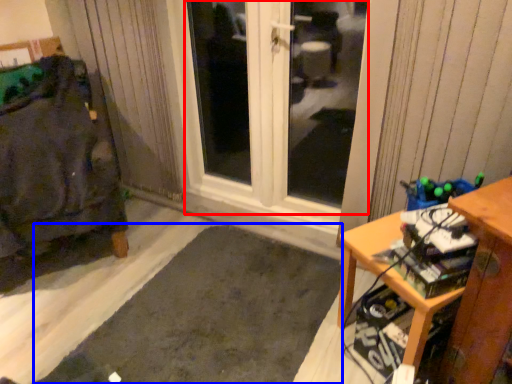
Question: Which object appears closest to the camera in this image, window (highlighted by a red box) or doormat (highlighted by a blue box)?

Choices:
 (A) window
 (B) doormat

Answer: (B)